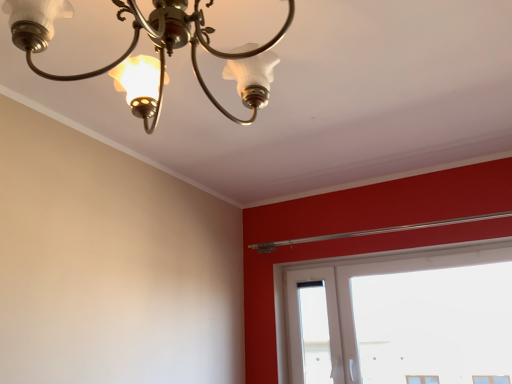
The image size is (512, 384). What do you see at coordinates (136, 44) in the screenshot? I see `matte glass chandelier at upper left` at bounding box center [136, 44].

Based on the photo, measure the distance between matte glass chandelier at upper left and camera.

A distance of 68.27 centimeters exists between matte glass chandelier at upper left and camera.

The height and width of the screenshot is (384, 512). I want to click on matte glass chandelier at upper left, so click(136, 44).

In order to face white plastic window at lower right, should I rotate leftwards or rightwards?

You should look right and rotate roughly 17.802 degrees.

Describe the element at coordinates (403, 317) in the screenshot. I see `white plastic window at lower right` at that location.

Locate an element on the screen. white plastic window at lower right is located at coordinates (403, 317).

Where is `matte glass chandelier at upper left`? matte glass chandelier at upper left is located at coordinates (136, 44).

Can you confirm if white plastic window at lower right is positioned to the left of matte glass chandelier at upper left?

In fact, white plastic window at lower right is to the right of matte glass chandelier at upper left.

Considering the relative positions of white plastic window at lower right and matte glass chandelier at upper left in the image provided, is white plastic window at lower right in front of matte glass chandelier at upper left?

No, white plastic window at lower right is further to the viewer.

Which point is more forward, (365, 347) or (160, 100)?

The point (160, 100) is in front.

From the image's perspective, which one is positioned lower, white plastic window at lower right or matte glass chandelier at upper left?

white plastic window at lower right appears lower in the image.

Looking at this image, from a real-world perspective, is white plastic window at lower right under matte glass chandelier at upper left?

Yes.

In the scene shown: In terms of width, does white plastic window at lower right look wider or thinner when compared to matte glass chandelier at upper left?

In the image, white plastic window at lower right appears to be more narrow than matte glass chandelier at upper left.

Can you confirm if white plastic window at lower right is shorter than matte glass chandelier at upper left?

No.

Considering the sizes of objects white plastic window at lower right and matte glass chandelier at upper left in the image provided, who is smaller, white plastic window at lower right or matte glass chandelier at upper left?

Smaller between the two is matte glass chandelier at upper left.

Is white plastic window at lower right surrounding matte glass chandelier at upper left?

Actually, matte glass chandelier at upper left is outside white plastic window at lower right.

Is white plastic window at lower right touching matte glass chandelier at upper left?

No, white plastic window at lower right is not in contact with matte glass chandelier at upper left.

Is white plastic window at lower right facing away from matte glass chandelier at upper left?

That's not correct — white plastic window at lower right is not looking away from matte glass chandelier at upper left.

How different are the orientations of white plastic window at lower right and matte glass chandelier at upper left in degrees?

The angle between the facing direction of white plastic window at lower right and the facing direction of matte glass chandelier at upper left is 92.7 degrees.

The width and height of the screenshot is (512, 384). Identify the location of window below the matte glass chandelier at upper left (from the image's perspective). (403, 317).

Does matte glass chandelier at upper left appear on the right side of white plastic window at lower right?

No.

Is matte glass chandelier at upper left further to the viewer compared to white plastic window at lower right?

No.

Which is in front, point (195, 70) or point (510, 294)?

The point (195, 70) is more forward.

From the image's perspective, relative to white plastic window at lower right, is matte glass chandelier at upper left above or below?

Clearly, from the image's perspective, matte glass chandelier at upper left is above white plastic window at lower right.

From a real-world perspective, who is located lower, matte glass chandelier at upper left or white plastic window at lower right?

white plastic window at lower right is physically lower.

Looking at this image, is matte glass chandelier at upper left wider than white plastic window at lower right?

Yes, matte glass chandelier at upper left is wider than white plastic window at lower right.

Considering the sizes of objects matte glass chandelier at upper left and white plastic window at lower right in the image provided, who is shorter, matte glass chandelier at upper left or white plastic window at lower right?

Standing shorter between the two is matte glass chandelier at upper left.

Considering the relative sizes of matte glass chandelier at upper left and white plastic window at lower right in the image provided, is matte glass chandelier at upper left bigger than white plastic window at lower right?

Incorrect, matte glass chandelier at upper left is not larger than white plastic window at lower right.

Is matte glass chandelier at upper left situated inside white plastic window at lower right or outside?

matte glass chandelier at upper left is spatially situated outside white plastic window at lower right.

Is matte glass chandelier at upper left not close to white plastic window at lower right?

Yes, matte glass chandelier at upper left and white plastic window at lower right are located far from each other.

Is matte glass chandelier at upper left aimed at white plastic window at lower right?

No, matte glass chandelier at upper left is not turned towards white plastic window at lower right.

Identify the location of lamp above the white plastic window at lower right (from the image's perspective). Image resolution: width=512 pixels, height=384 pixels. (136, 44).

In the image, there is a matte glass chandelier at upper left. Where is `window below it (from the image's perspective)`? The image size is (512, 384). window below it (from the image's perspective) is located at coordinates (403, 317).

Image resolution: width=512 pixels, height=384 pixels. I want to click on lamp lying in front of the white plastic window at lower right, so click(x=136, y=44).